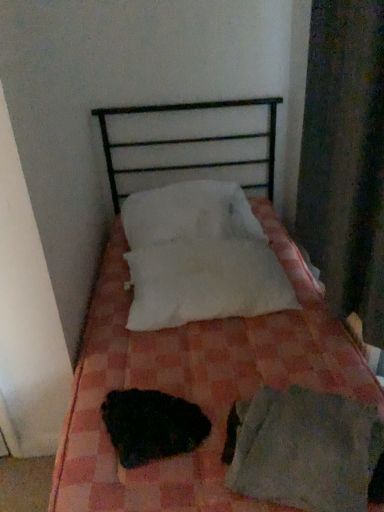
What do you see at coordinates (189, 213) in the screenshot? The image size is (384, 512). I see `white soft pillow at center, the 2th pillow from the bottom` at bounding box center [189, 213].

At what (x,y) coordinates should I click in order to perform the action: click on white soft pillow at center, which ranks as the 1th pillow in top-to-bottom order. Please return your answer as a coordinate pair (x, y). The width and height of the screenshot is (384, 512). Looking at the image, I should click on (189, 213).

From the image's perspective, is white soft pillow at center, which ranks as the 1th pillow in top-to-bottom order, positioned above or below pink checkered bed at center?

white soft pillow at center, which ranks as the 1th pillow in top-to-bottom order, is above pink checkered bed at center.

Based on their sizes in the image, would you say white soft pillow at center, the 2th pillow from the bottom, is bigger or smaller than pink checkered bed at center?

In the image, white soft pillow at center, the 2th pillow from the bottom, appears to be smaller than pink checkered bed at center.

Considering the positions of objects white soft pillow at center, the 2th pillow from the bottom, and pink checkered bed at center in the image provided, who is more to the right, white soft pillow at center, the 2th pillow from the bottom, or pink checkered bed at center?

pink checkered bed at center is more to the right.

Considering the positions of point (229, 221) and point (108, 317), is point (229, 221) closer or farther from the camera than point (108, 317)?

Point (229, 221) is positioned farther from the camera compared to point (108, 317).

In the scene shown: Is white soft pillow at center, the 2th pillow from the bottom, oriented away from white fluffy pillow at center, acting as the second pillow starting from the top?

No, white fluffy pillow at center, acting as the second pillow starting from the top, is not at the back of white soft pillow at center, the 2th pillow from the bottom.

Is white soft pillow at center, which ranks as the 1th pillow in top-to-bottom order, not near white fluffy pillow at center, which ranks as the 1th pillow in bottom-to-top order?

No, there isn't a large distance between white soft pillow at center, which ranks as the 1th pillow in top-to-bottom order, and white fluffy pillow at center, which ranks as the 1th pillow in bottom-to-top order.

Considering the positions of objects white soft pillow at center, the 2th pillow from the bottom, and white fluffy pillow at center, which ranks as the 1th pillow in bottom-to-top order, in the image provided, who is more to the right, white soft pillow at center, the 2th pillow from the bottom, or white fluffy pillow at center, which ranks as the 1th pillow in bottom-to-top order,?

From the viewer's perspective, white fluffy pillow at center, which ranks as the 1th pillow in bottom-to-top order, appears more on the right side.

Considering the relative sizes of white soft pillow at center, the 2th pillow from the bottom, and white fluffy pillow at center, acting as the second pillow starting from the top, in the image provided, is white soft pillow at center, the 2th pillow from the bottom, wider than white fluffy pillow at center, acting as the second pillow starting from the top,?

Correct, the width of white soft pillow at center, the 2th pillow from the bottom, exceeds that of white fluffy pillow at center, acting as the second pillow starting from the top.

Which of these two, black fuzzy animal at center or light gray cotton sheet at lower right, is bigger?

light gray cotton sheet at lower right is bigger.

Does black fuzzy animal at center appear on the right side of light gray cotton sheet at lower right?

In fact, black fuzzy animal at center is to the left of light gray cotton sheet at lower right.

Between black fuzzy animal at center and light gray cotton sheet at lower right, which one has less height?

Standing shorter between the two is black fuzzy animal at center.

Is black fuzzy animal at center next to light gray cotton sheet at lower right?

black fuzzy animal at center and light gray cotton sheet at lower right are not in contact.

Identify the location of sheet located on the right of white soft pillow at center, the 2th pillow from the bottom. (305, 450).

Between light gray cotton sheet at lower right and white soft pillow at center, which ranks as the 1th pillow in top-to-bottom order, which one has larger size?

Bigger between the two is white soft pillow at center, which ranks as the 1th pillow in top-to-bottom order.

From the image's perspective, between light gray cotton sheet at lower right and white soft pillow at center, the 2th pillow from the bottom, which one is located above?

white soft pillow at center, the 2th pillow from the bottom, from the image's perspective.

Can you confirm if white fluffy pillow at center, which ranks as the 1th pillow in bottom-to-top order, is bigger than pink checkered bed at center?

No, white fluffy pillow at center, which ranks as the 1th pillow in bottom-to-top order, is not bigger than pink checkered bed at center.

How different are the orientations of white fluffy pillow at center, acting as the second pillow starting from the top, and pink checkered bed at center in degrees?

4.01 degrees separate the facing orientations of white fluffy pillow at center, acting as the second pillow starting from the top, and pink checkered bed at center.

From the image's perspective, is white fluffy pillow at center, acting as the second pillow starting from the top, located above pink checkered bed at center?

Yes, from the image's perspective, white fluffy pillow at center, acting as the second pillow starting from the top, is over pink checkered bed at center.

Considering the points (323, 367) and (197, 239), which point is in front, point (323, 367) or point (197, 239)?

Positioned in front is point (323, 367).

Between pink checkered bed at center and white fluffy pillow at center, acting as the second pillow starting from the top, which one is positioned in front?

Positioned in front is pink checkered bed at center.

Could you tell me if pink checkered bed at center is turned towards white fluffy pillow at center, which ranks as the 1th pillow in bottom-to-top order?

Yes, pink checkered bed at center faces towards white fluffy pillow at center, which ranks as the 1th pillow in bottom-to-top order.

Is pink checkered bed at center taller or shorter than white fluffy pillow at center, which ranks as the 1th pillow in bottom-to-top order?

In the image, pink checkered bed at center appears to be taller than white fluffy pillow at center, which ranks as the 1th pillow in bottom-to-top order.

Looking at their sizes, would you say black fuzzy animal at center is wider or thinner than white fluffy pillow at center, which ranks as the 1th pillow in bottom-to-top order?

In the image, black fuzzy animal at center appears to be more narrow than white fluffy pillow at center, which ranks as the 1th pillow in bottom-to-top order.

From a real-world perspective, relative to white fluffy pillow at center, which ranks as the 1th pillow in bottom-to-top order, is black fuzzy animal at center vertically above or below?

black fuzzy animal at center is situated lower than white fluffy pillow at center, which ranks as the 1th pillow in bottom-to-top order, in the real world.

Is black fuzzy animal at center next to white fluffy pillow at center, which ranks as the 1th pillow in bottom-to-top order?

black fuzzy animal at center is not next to white fluffy pillow at center, which ranks as the 1th pillow in bottom-to-top order, and they're not touching.

Is point (115, 398) more distant than point (226, 264)?

No, it is not.

You are a GUI agent. You are given a task and a screenshot of the screen. Output one action in this format:
    pyautogui.click(x=<x>, y=<y>)
    Task: Click on the bed that appears below the white soft pillow at center, which ranks as the 1th pillow in top-to-bottom order (from the image's perspective)
    The height and width of the screenshot is (512, 384).
    Given the screenshot: What is the action you would take?
    pyautogui.click(x=193, y=385)

This screenshot has width=384, height=512. I want to click on pillow that is in front of the white soft pillow at center, which ranks as the 1th pillow in top-to-bottom order, so click(x=205, y=282).

Based on their spatial positions, is black fuzzy animal at center or white fluffy pillow at center, which ranks as the 1th pillow in bottom-to-top order, closer to light gray cotton sheet at lower right?

black fuzzy animal at center lies closer to light gray cotton sheet at lower right than the other object.

When comparing their distances from pink checkered bed at center, does white soft pillow at center, which ranks as the 1th pillow in top-to-bottom order, or white fluffy pillow at center, acting as the second pillow starting from the top, seem closer?

white fluffy pillow at center, acting as the second pillow starting from the top, is closer to pink checkered bed at center.

Considering their positions, is white fluffy pillow at center, acting as the second pillow starting from the top, positioned closer to light gray cotton sheet at lower right than pink checkered bed at center?

pink checkered bed at center lies closer to light gray cotton sheet at lower right than the other object.

Estimate the real-world distances between objects in this image. Which object is closer to white soft pillow at center, the 2th pillow from the bottom, white fluffy pillow at center, which ranks as the 1th pillow in bottom-to-top order, or black fuzzy animal at center?

Based on the image, white fluffy pillow at center, which ranks as the 1th pillow in bottom-to-top order, appears to be nearer to white soft pillow at center, the 2th pillow from the bottom.

Looking at the image, which one is located closer to white soft pillow at center, the 2th pillow from the bottom, light gray cotton sheet at lower right or pink checkered bed at center?

pink checkered bed at center is positioned closer to the anchor white soft pillow at center, the 2th pillow from the bottom.

Based on their spatial positions, is black fuzzy animal at center or pink checkered bed at center closer to white fluffy pillow at center, which ranks as the 1th pillow in bottom-to-top order?

pink checkered bed at center lies closer to white fluffy pillow at center, which ranks as the 1th pillow in bottom-to-top order, than the other object.

When comparing their distances from pink checkered bed at center, does light gray cotton sheet at lower right or black fuzzy animal at center seem further?

Among the two, light gray cotton sheet at lower right is located further to pink checkered bed at center.

From the image, which object appears to be nearer to pink checkered bed at center, white soft pillow at center, which ranks as the 1th pillow in top-to-bottom order, or light gray cotton sheet at lower right?

Among the two, light gray cotton sheet at lower right is located nearer to pink checkered bed at center.

You are a GUI agent. You are given a task and a screenshot of the screen. Output one action in this format:
    pyautogui.click(x=<x>, y=<y>)
    Task: Click on the sheet between pink checkered bed at center and white fluffy pillow at center, which ranks as the 1th pillow in bottom-to-top order, from front to back
    This screenshot has height=512, width=384.
    Given the screenshot: What is the action you would take?
    pyautogui.click(x=305, y=450)

Where is `animal between pink checkered bed at center and white fluffy pillow at center, which ranks as the 1th pillow in bottom-to-top order, in the front-back direction`? The image size is (384, 512). animal between pink checkered bed at center and white fluffy pillow at center, which ranks as the 1th pillow in bottom-to-top order, in the front-back direction is located at coordinates (152, 425).

Find the location of a particular element. This screenshot has width=384, height=512. animal between light gray cotton sheet at lower right and white fluffy pillow at center, acting as the second pillow starting from the top, along the z-axis is located at coordinates (152, 425).

The image size is (384, 512). I want to click on animal located between light gray cotton sheet at lower right and white soft pillow at center, the 2th pillow from the bottom, in the depth direction, so click(x=152, y=425).